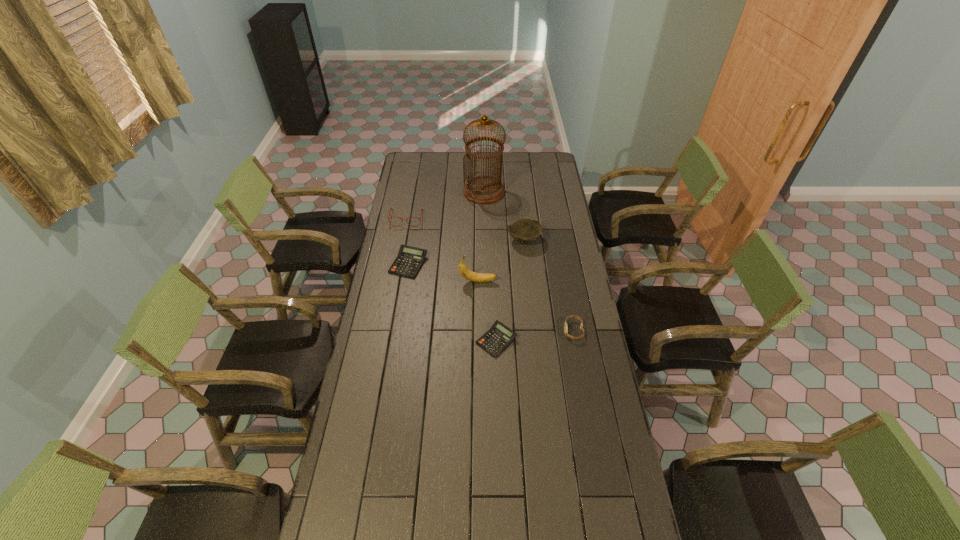
Please point out where to position a new calculator on the right to maintain spacing. Please provide its 2D coordinates. Your answer should be formatted as a tuple, i.e. [(x, y)], where the tuple contains the x and y coordinates of a point satisfying the conditions above.

[(621, 449)]